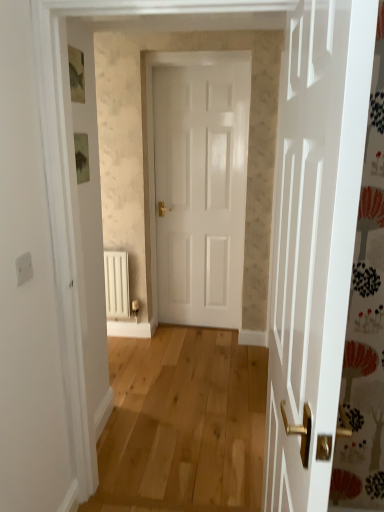
You are a GUI agent. You are given a task and a screenshot of the screen. Output one action in this format:
    pyautogui.click(x=<x>, y=<y>)
    Task: Click on the white glossy door at center
    
    Given the screenshot: What is the action you would take?
    pyautogui.click(x=197, y=183)

What do you see at coordinates (197, 183) in the screenshot? Image resolution: width=384 pixels, height=512 pixels. I see `white glossy door at center` at bounding box center [197, 183].

The height and width of the screenshot is (512, 384). What do you see at coordinates (116, 284) in the screenshot?
I see `white matte radiator at lower left` at bounding box center [116, 284].

The width and height of the screenshot is (384, 512). What are the coordinates of `white matte radiator at lower left` in the screenshot? It's located at (116, 284).

This screenshot has width=384, height=512. Identify the location of white glossy door at center. (197, 183).

Which is more to the right, white glossy door at center or white matte radiator at lower left?

white glossy door at center is more to the right.

Which is in front, white glossy door at center or white matte radiator at lower left?

white glossy door at center is closer to the camera.

Does point (194, 301) come farther from viewer compared to point (107, 298)?

Yes.

From the image's perspective, which is below, white glossy door at center or white matte radiator at lower left?

white matte radiator at lower left is shown below in the image.

From a real-world perspective, which object stands above the other?

white glossy door at center is physically above.

Considering the relative sizes of white glossy door at center and white matte radiator at lower left in the image provided, is white glossy door at center thinner than white matte radiator at lower left?

Yes.

Between white glossy door at center and white matte radiator at lower left, which one has less height?

With less height is white matte radiator at lower left.

In terms of size, does white glossy door at center appear bigger or smaller than white matte radiator at lower left?

Considering their sizes, white glossy door at center takes up more space than white matte radiator at lower left.

In the scene shown: Is white glossy door at center not within white matte radiator at lower left?

Indeed, white glossy door at center is completely outside white matte radiator at lower left.

Can you see white glossy door at center touching white matte radiator at lower left?

No, white glossy door at center is not making contact with white matte radiator at lower left.

Is white glossy door at center aimed at white matte radiator at lower left?

No, white glossy door at center is not oriented towards white matte radiator at lower left.

In the scene shown: How far apart are white glossy door at center and white matte radiator at lower left?

white glossy door at center and white matte radiator at lower left are 27.88 inches apart from each other.

In the image, there is a white matte radiator at lower left. Where is `door above it (from the image's perspective)`? This screenshot has height=512, width=384. door above it (from the image's perspective) is located at coordinates (197, 183).

Looking at this image, can you confirm if white matte radiator at lower left is positioned to the left of white glossy door at center?

Indeed, white matte radiator at lower left is positioned on the left side of white glossy door at center.

Between white matte radiator at lower left and white glossy door at center, which one is positioned in front?

white glossy door at center is in front.

Is point (109, 301) positioned in front of point (159, 161)?

No, (109, 301) is further to viewer.

From the image's perspective, is white matte radiator at lower left above or below white glossy door at center?

Clearly, from the image's perspective, white matte radiator at lower left is below white glossy door at center.

From a real-world perspective, is white matte radiator at lower left over white glossy door at center?

No.

From the picture: Considering the sizes of objects white matte radiator at lower left and white glossy door at center in the image provided, who is thinner, white matte radiator at lower left or white glossy door at center?

white glossy door at center is thinner.

Considering the sizes of objects white matte radiator at lower left and white glossy door at center in the image provided, who is shorter, white matte radiator at lower left or white glossy door at center?

Standing shorter between the two is white matte radiator at lower left.

Based on the photo, considering the relative sizes of white matte radiator at lower left and white glossy door at center in the image provided, is white matte radiator at lower left smaller than white glossy door at center?

Correct, white matte radiator at lower left occupies less space than white glossy door at center.

Is white glossy door at center inside white matte radiator at lower left?

No, white matte radiator at lower left does not contain white glossy door at center.

Is white matte radiator at lower left in contact with white glossy door at center?

No, white matte radiator at lower left is not with white glossy door at center.

Is white matte radiator at lower left facing away from white glossy door at center?

white matte radiator at lower left does not have its back to white glossy door at center.

What's the angular difference between white matte radiator at lower left and white glossy door at center's facing directions?

white matte radiator at lower left and white glossy door at center are facing 3.84 degrees away from each other.

You are a GUI agent. You are given a task and a screenshot of the screen. Output one action in this format:
    pyautogui.click(x=<x>, y=<y>)
    Task: Click on the door located on the right of white matte radiator at lower left
    The image size is (384, 512).
    Given the screenshot: What is the action you would take?
    pyautogui.click(x=197, y=183)

This screenshot has width=384, height=512. In order to click on door in front of the white matte radiator at lower left in this screenshot , I will do `click(197, 183)`.

The image size is (384, 512). What are the coordinates of `radiator on the left of white glossy door at center` in the screenshot? It's located at (116, 284).